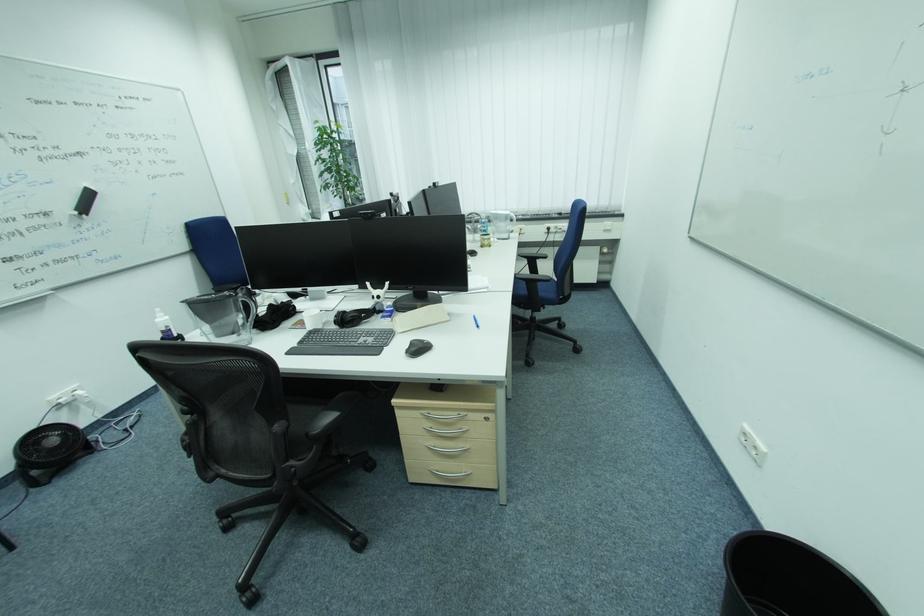
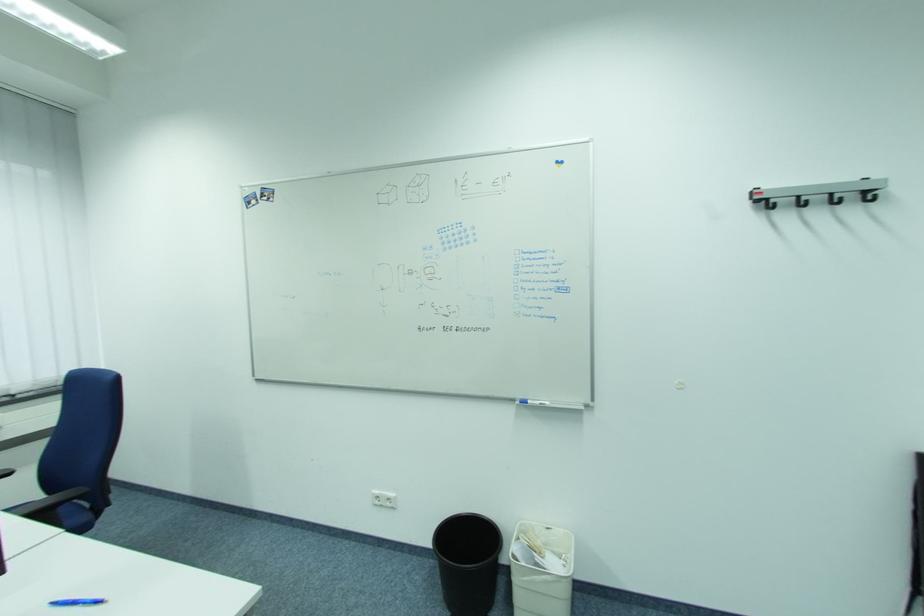
In the second image, find the point that corresponds to point (480, 317) in the first image.

(57, 605)